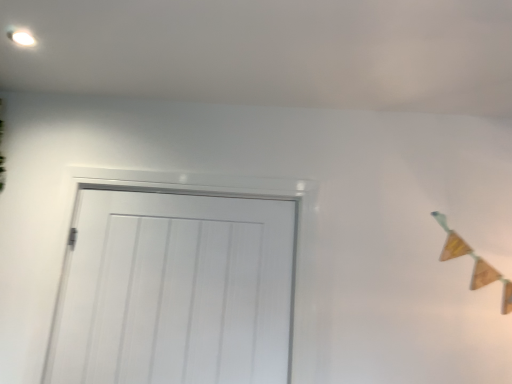
Locate an element on the screen. This screenshot has width=512, height=384. white matte door at center is located at coordinates (176, 288).

What do you see at coordinates (176, 288) in the screenshot? I see `white matte door at center` at bounding box center [176, 288].

The height and width of the screenshot is (384, 512). In order to click on white matte door at center in this screenshot , I will do [x=176, y=288].